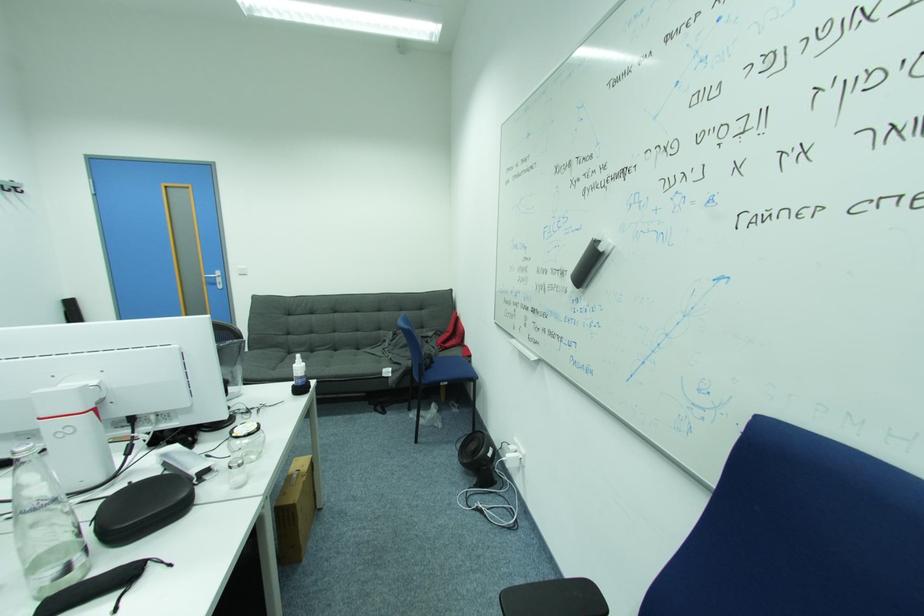
Locate an element on the screen. The width and height of the screenshot is (924, 616). sofa sitting surface is located at coordinates (329, 357).